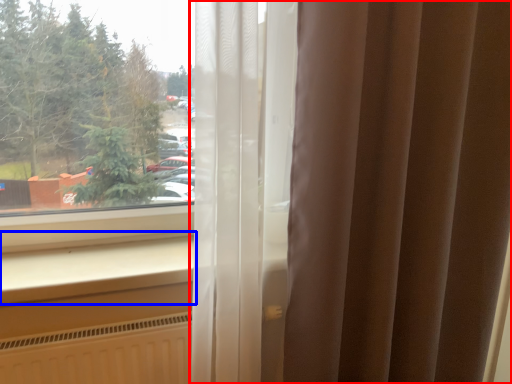
Question: Which object appears farthest to the camera in this image, curtain (highlighted by a red box) or window sill (highlighted by a blue box)?

Choices:
 (A) curtain
 (B) window sill

Answer: (B)